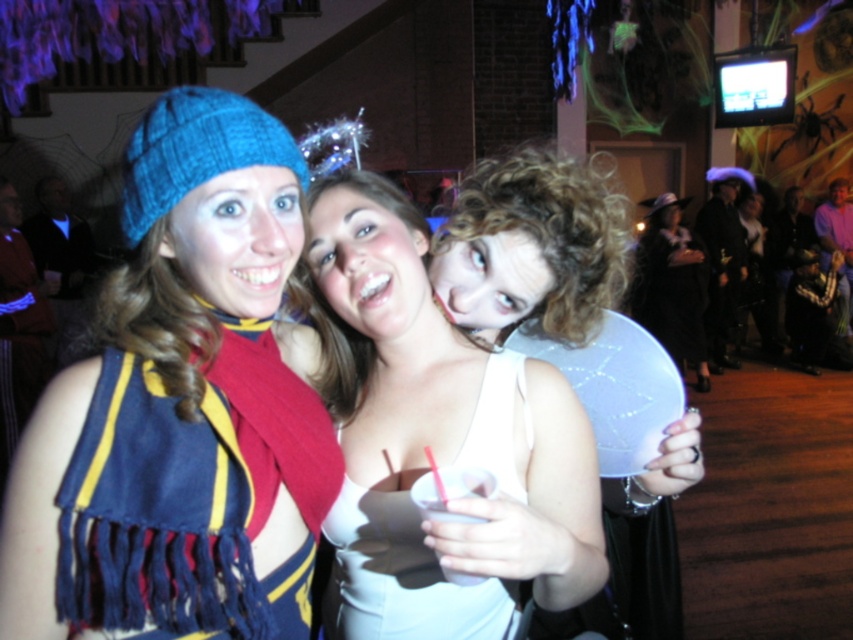
Looking at this image, who is positioned more to the left, white matte wings at center or white matte balloon at center?

white matte wings at center is more to the left.

Between point (616, 248) and point (653, 291), which one is positioned behind?

The point (653, 291) is more distant.

Find the location of a particular element. Image resolution: width=853 pixels, height=640 pixels. white matte wings at center is located at coordinates (532, 248).

Which is more to the left, knitted woolen hat at upper left or curly hair at center?

knitted woolen hat at upper left is more to the left.

Consider the image. Is knitted woolen hat at upper left thinner than curly hair at center?

Indeed, knitted woolen hat at upper left has a lesser width compared to curly hair at center.

Between point (169, 252) and point (567, 225), which one is positioned behind?

The point (567, 225) is more distant.

Locate an element on the screen. Image resolution: width=853 pixels, height=640 pixels. knitted woolen hat at upper left is located at coordinates (172, 400).

The height and width of the screenshot is (640, 853). What do you see at coordinates (532, 246) in the screenshot? I see `curly hair at center` at bounding box center [532, 246].

Does curly hair at center have a lesser width compared to white matte dress at center?

No.

Is point (599, 256) behind point (337, 593)?

Yes, it is.

Image resolution: width=853 pixels, height=640 pixels. What are the coordinates of `curly hair at center` in the screenshot? It's located at (532, 246).